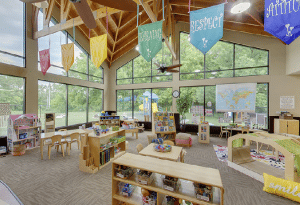
Where is `book shelf`? book shelf is located at coordinates (159, 184), (109, 142), (111, 118), (162, 123), (202, 130).